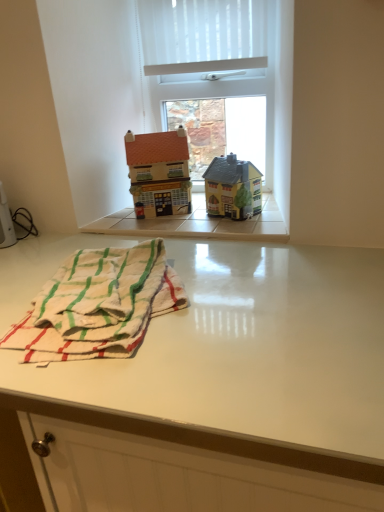
Image resolution: width=384 pixels, height=512 pixels. What are the coordinates of `empty space that is in between matte brown house at center, placed as the 1th toy when sorted from left to right, and yellow matte house at center, which is counted as the second toy, starting from the left` in the screenshot? It's located at (189, 220).